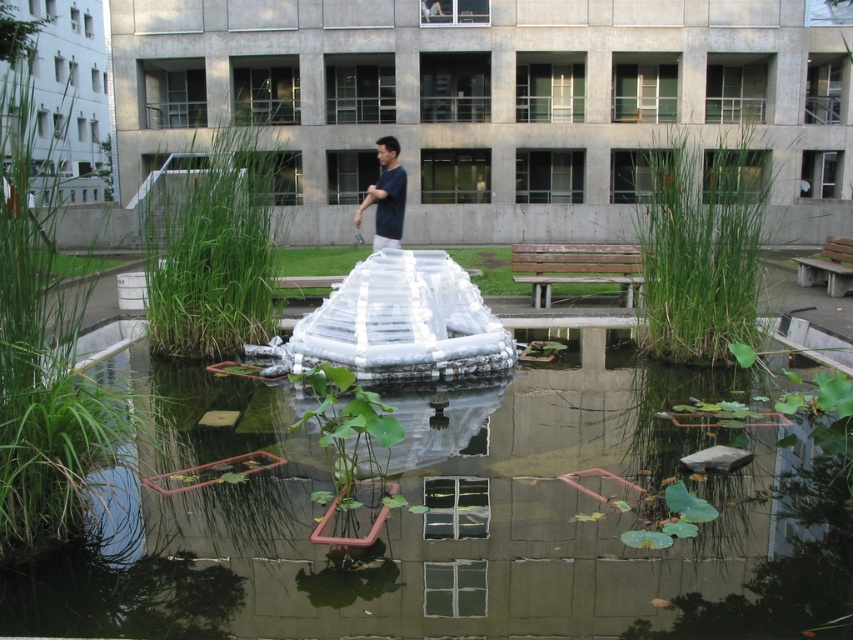
Question: Among these points, which one is nearest to the camera?

Choices:
 (A) (605, 381)
 (B) (360, 218)

Answer: (A)

Question: Can you confirm if clear water at center is thinner than dark blue shirt at center?

Choices:
 (A) yes
 (B) no

Answer: (B)

Question: Is clear water at center thinner than dark blue shirt at center?

Choices:
 (A) yes
 (B) no

Answer: (B)

Question: Can you confirm if clear water at center is positioned above dark blue shirt at center?

Choices:
 (A) no
 (B) yes

Answer: (A)

Question: Which point appears farthest from the camera in this image?

Choices:
 (A) (320, 634)
 (B) (389, 230)

Answer: (B)